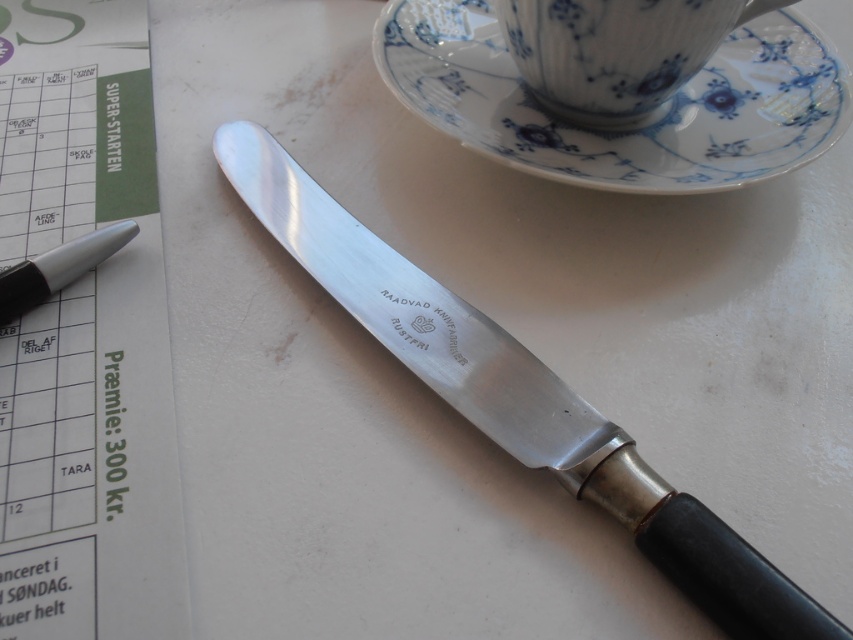
You are setting up a table for a formal event and need to place the polished metal knife at center and the metallic silver pen at left. Based on their positions, which item would a guest see first when looking directly at the table?

The polished metal knife at center would be seen first because it is positioned in front of the metallic silver pen at left, making it closer to the viewer.

Based on the scene description, where is the white porcelain saucer at upper right located?

The white porcelain saucer at upper right is located at point (x=633, y=129).